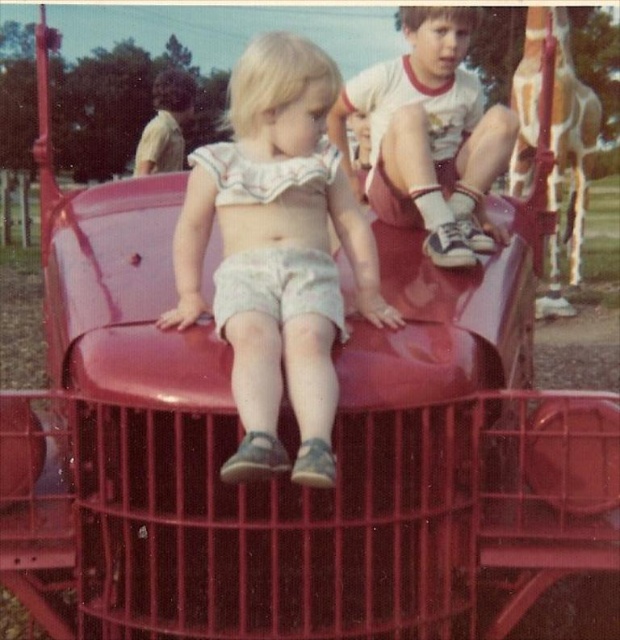
You are a photographer trying to capture a candid shot of the children on the slide. You want to ensure that both the matte white shorts at center and the white cotton shirt at upper right are visible in the frame. Based on their positions, which object should you focus on first to include both in the shot?

The matte white shorts at center is positioned on the left side of the white cotton shirt at upper right. To include both in the frame, focus on the matte white shorts at center first as it is closer to the left edge, then adjust to include the white cotton shirt at upper right on the right side.

You are a photographer trying to capture a clear photo of both the matte white shorts at center and the white cotton shirt at upper right. Which object should you focus on first to ensure both are in focus?

You should focus on the matte white shorts at center first because it is in front of the white cotton shirt at upper right, so focusing on the closer object will help both be in focus.